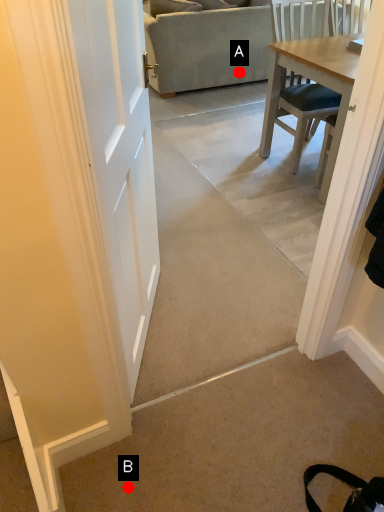
Question: Two points are circled on the image, labeled by A and B beside each circle. Which point is closer to the camera?

Choices:
 (A) A is closer
 (B) B is closer

Answer: (B)